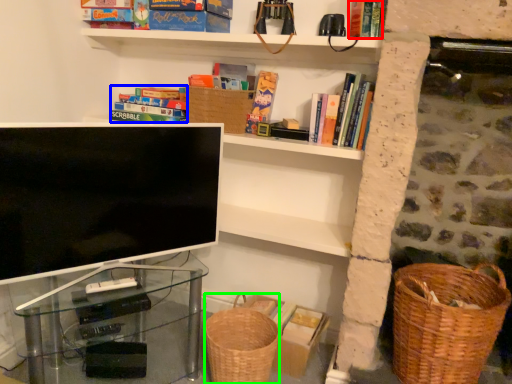
Question: Which is nearer to the book (highlighted by a red box)? book (highlighted by a blue box) or basket container (highlighted by a green box).

Choices:
 (A) book
 (B) basket container

Answer: (A)